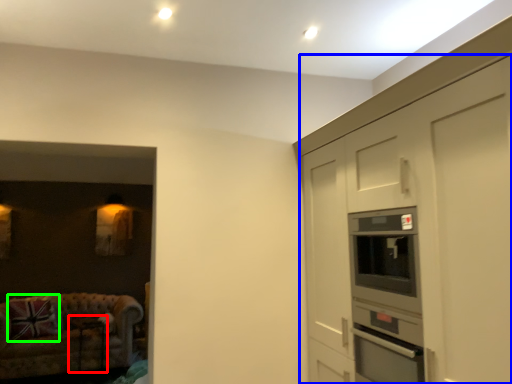
Question: Estimate the real-world distances between objects in this image. Which object is farther from table (highlighted by a red box), cabinetry (highlighted by a blue box) or pillow (highlighted by a green box)?

Choices:
 (A) cabinetry
 (B) pillow

Answer: (A)